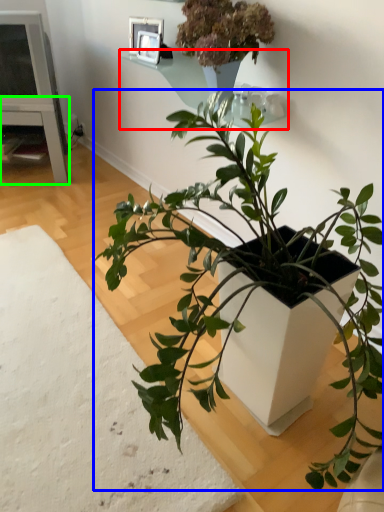
Question: Which object is positioned farthest from window sill (highlighted by a red box)? Select from houseplant (highlighted by a blue box) and table (highlighted by a green box).

Choices:
 (A) houseplant
 (B) table

Answer: (B)